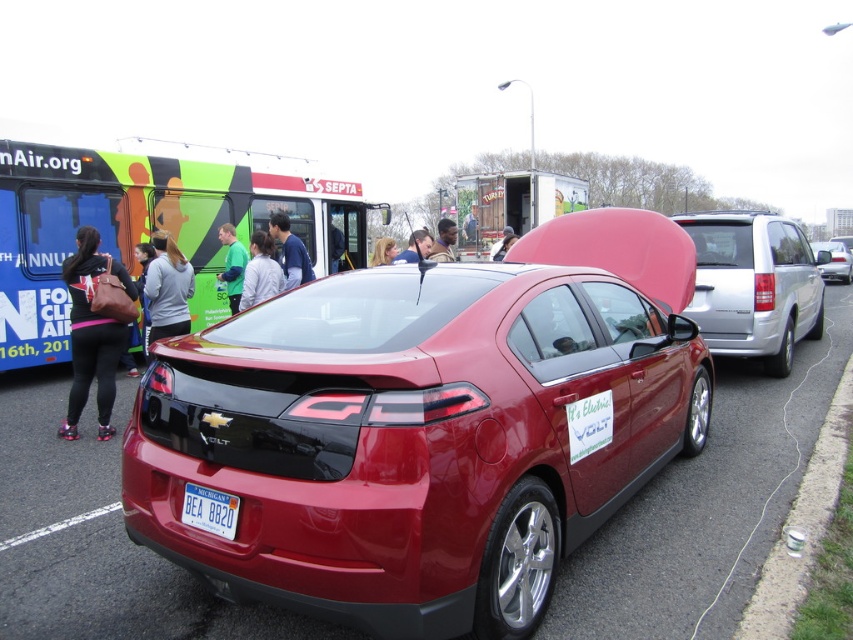
You are organizing a car show and need to arrange vehicles and items in order of size from smallest to largest. Given the silver metallic minivan at right and the gray fleece jacket at center, which should come first in the list?

The gray fleece jacket at center should come first since it is smaller than the silver metallic minivan at right.

You are a photographer at the event and want to capture a photo of the Chevrolet Volt car. You notice the white plastic license plate at rear and the smooth skin face at center. Which object is positioned lower in the image?

The white plastic license plate at rear is positioned below the smooth skin face at center, so it is lower in the image.